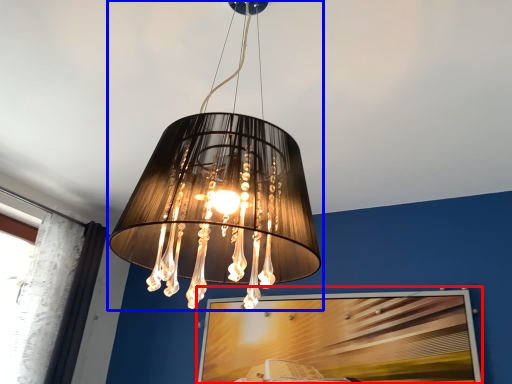
Question: Among these objects, which one is nearest to the camera, picture frame (highlighted by a red box) or lamp (highlighted by a blue box)?

Choices:
 (A) picture frame
 (B) lamp

Answer: (B)